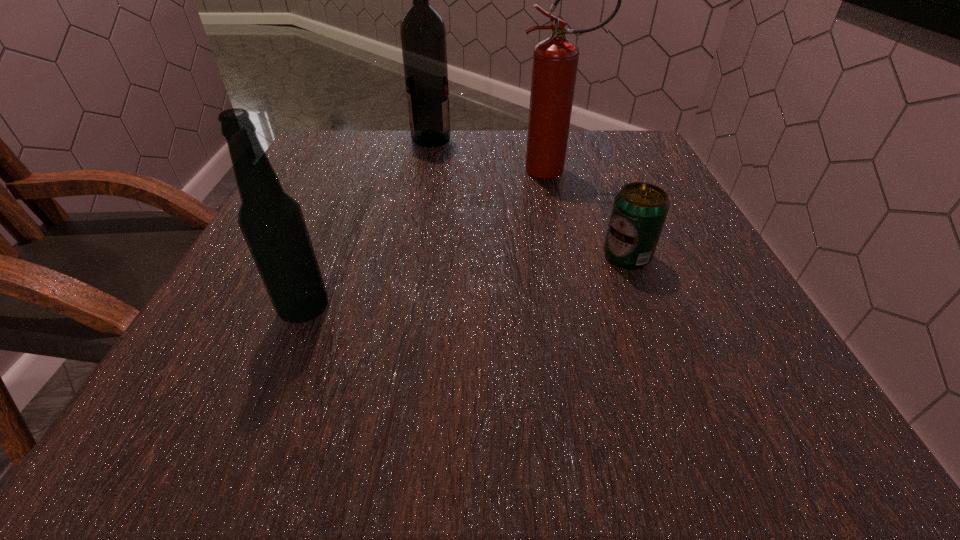
I want to click on free space between the shortest object and the nearest object, so pos(466,283).

You are a GUI agent. You are given a task and a screenshot of the screen. Output one action in this format:
    pyautogui.click(x=<x>, y=<y>)
    Task: Click on the vacant space that's between the fire extinguisher and the taller alcohol
    The height and width of the screenshot is (540, 960).
    Given the screenshot: What is the action you would take?
    pyautogui.click(x=492, y=155)

Where is `free space between the third nearest object and the taller alcohol`? free space between the third nearest object and the taller alcohol is located at coordinates (492, 155).

Where is `vacant region between the fire extinguisher and the right alcohol`? Image resolution: width=960 pixels, height=540 pixels. vacant region between the fire extinguisher and the right alcohol is located at coordinates (492, 155).

Locate an element on the screen. vacant area between the taller alcohol and the nearest object is located at coordinates (368, 225).

I want to click on empty space between the farther alcohol and the second shortest object, so click(368, 225).

Find the location of `free area in between the third tallest object and the shortest object`. free area in between the third tallest object and the shortest object is located at coordinates (466, 283).

Where is `object that ranks as the closest to the right alcohol`? object that ranks as the closest to the right alcohol is located at coordinates (555, 60).

Identify which object is the nearest to the fire extinguisher. Please provide its 2D coordinates. Your answer should be formatted as a tuple, i.e. [(x, y)], where the tuple contains the x and y coordinates of a point satisfying the conditions above.

[(423, 35)]

I want to click on vacant region that satisfies the following two spatial constraints: 1. on the front and back of the beer can; 2. on the left side of the farther alcohol, so click(409, 256).